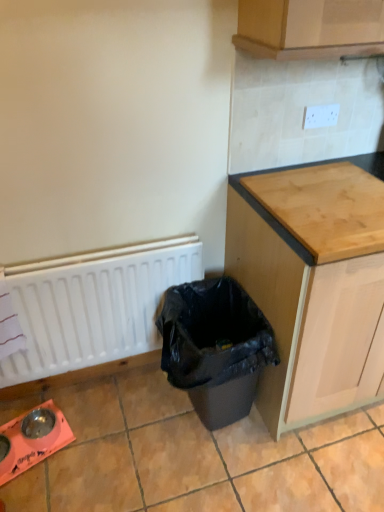
The height and width of the screenshot is (512, 384). Find the location of `free spot below black plastic waste bin at lower center (from a real-world perspective)`. free spot below black plastic waste bin at lower center (from a real-world perspective) is located at coordinates (197, 423).